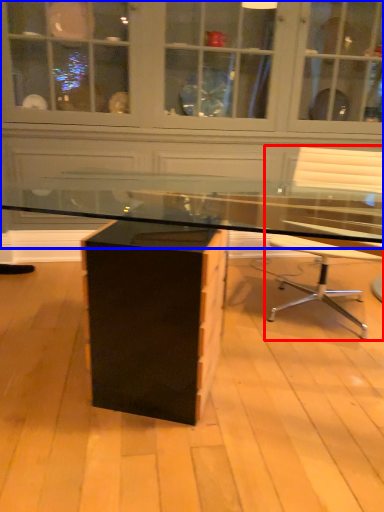
Question: Among these objects, which one is nearest to the camera, chair (highlighted by a red box) or dresser (highlighted by a blue box)?

Choices:
 (A) chair
 (B) dresser

Answer: (A)